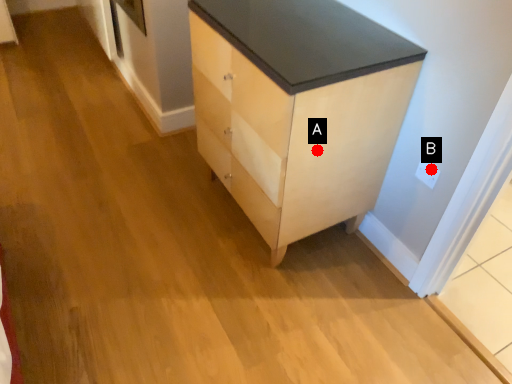
Question: Two points are circled on the image, labeled by A and B beside each circle. Which point appears closest to the camera in this image?

Choices:
 (A) A is closer
 (B) B is closer

Answer: (A)